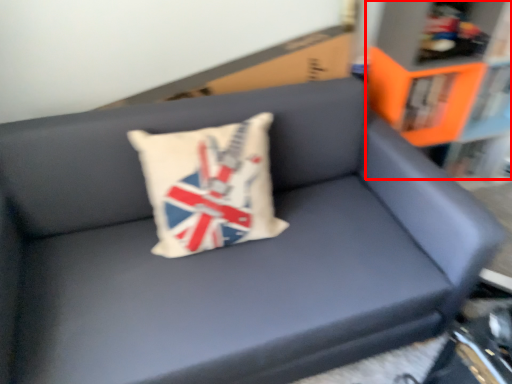
Question: From the image's perspective, where is bookcase (annotated by the red box) located in relation to pillow in the image?

Choices:
 (A) below
 (B) above

Answer: (B)